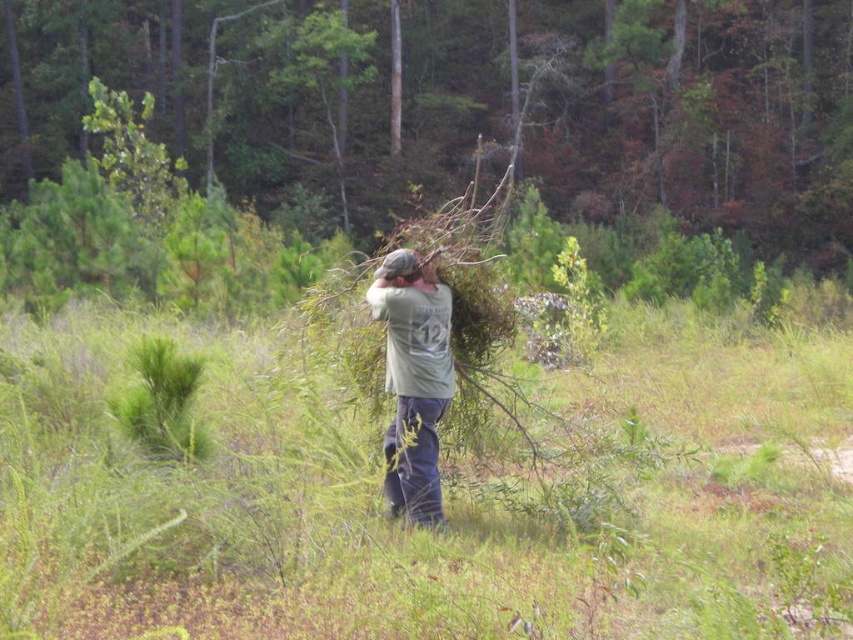
Question: Estimate the real-world distances between objects in this image. Which object is closer to the green grass at center?

Choices:
 (A) gray matte hair at center
 (B) brown textured branches at center

Answer: (A)

Question: Which point appears closest to the camera in this image?

Choices:
 (A) (813, 532)
 (B) (747, 70)
 (C) (381, 275)
 (D) (445, 362)

Answer: (A)

Question: Which of the following is the closest to the observer?

Choices:
 (A) (305, 180)
 (B) (187, 512)

Answer: (B)

Question: Is brown textured branches at center bigger than gray matte hair at center?

Choices:
 (A) no
 (B) yes

Answer: (B)

Question: Is green grass at center positioned before green matte shirt at center?

Choices:
 (A) yes
 (B) no

Answer: (A)

Question: Can you confirm if green grass at center is positioned to the left of gray matte hair at center?

Choices:
 (A) no
 (B) yes

Answer: (B)